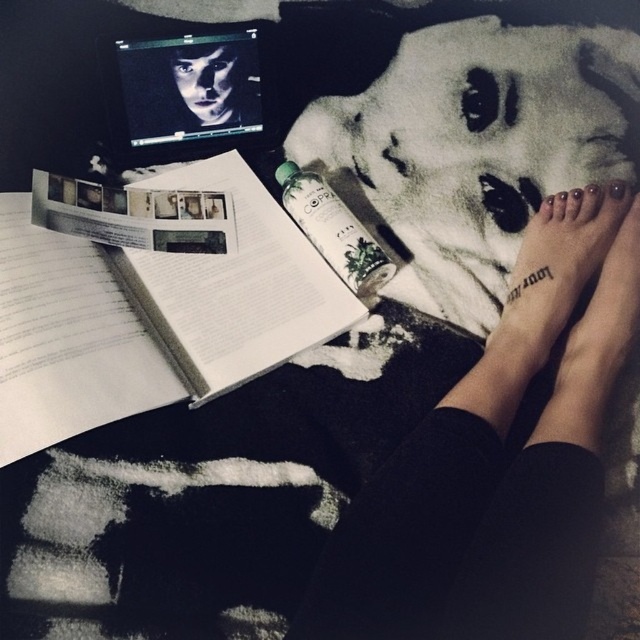
Question: Which of the following is the farthest from the observer?

Choices:
 (A) (32, 358)
 (B) (314, 225)
 (C) (260, 129)
 (D) (572, 400)

Answer: (C)

Question: Is smooth skin feet at lower right smaller than clear glass spray bottle at center?

Choices:
 (A) no
 (B) yes

Answer: (A)

Question: Is white paper book at center thinner than clear glass spray bottle at center?

Choices:
 (A) no
 (B) yes

Answer: (A)

Question: Which of these objects is positioned closest to the black matte feet at lower right?

Choices:
 (A) clear glass spray bottle at center
 (B) black glossy laptop at upper left
 (C) white paper book at center

Answer: (A)

Question: Does white matte towel at upper center have a lesser width compared to clear glass spray bottle at center?

Choices:
 (A) yes
 (B) no

Answer: (B)

Question: Which object is closer to the camera taking this photo?

Choices:
 (A) black glossy laptop at upper left
 (B) white paper book at center

Answer: (B)